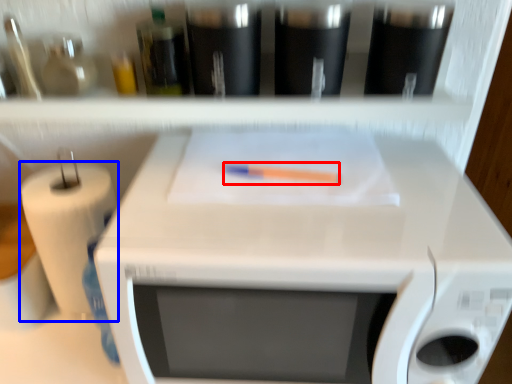
Question: Which of the following is the farthest to the observer, crayon (highlighted by a red box) or paper towel (highlighted by a blue box)?

Choices:
 (A) crayon
 (B) paper towel

Answer: (B)